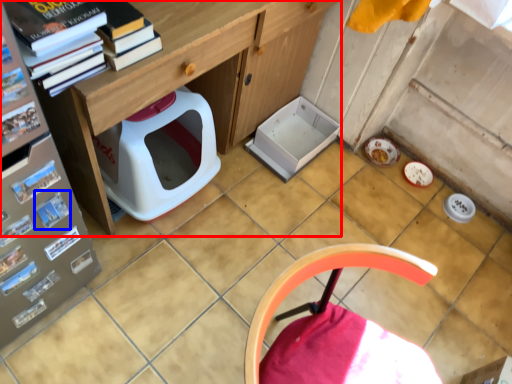
Question: Which object is closer to the camera taking this photo, desk (highlighted by a red box) or magazine (highlighted by a blue box)?

Choices:
 (A) desk
 (B) magazine

Answer: (A)